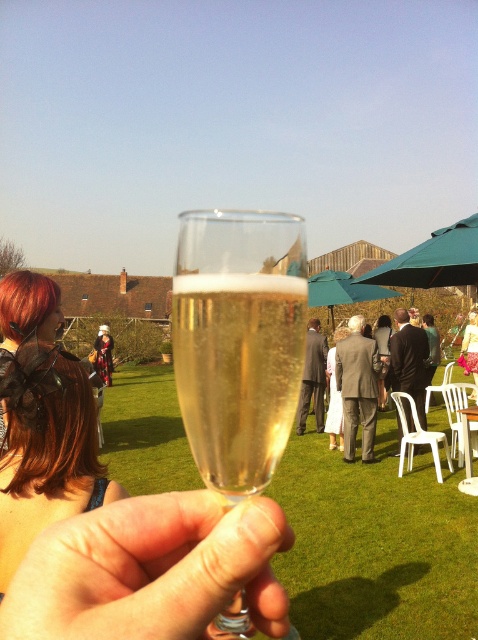
Between green grass at center and teal fabric umbrella at upper right, which one appears on the right side from the viewer's perspective?

teal fabric umbrella at upper right is more to the right.

Which is behind, point (282, 579) or point (379, 280)?

Positioned behind is point (379, 280).

You are a GUI agent. You are given a task and a screenshot of the screen. Output one action in this format:
    pyautogui.click(x=<x>, y=<y>)
    Task: Click on the green grass at center
    
    Given the screenshot: What is the action you would take?
    pyautogui.click(x=375, y=544)

Who is more distant from viewer, (151, 417) or (237, 282)?

Positioned behind is point (151, 417).

Can you confirm if green grass at center is bigger than translucent glass flute at center?

Yes.

Is point (325, 544) closer to camera compared to point (256, 314)?

No.

In order to click on green grass at center in this screenshot , I will do `click(375, 544)`.

Is point (62, 536) behind point (198, 326)?

That is False.

Does translucent glass at center have a greater width compared to translucent glass flute at center?

Indeed, translucent glass at center has a greater width compared to translucent glass flute at center.

Locate an element on the screen. translucent glass at center is located at coordinates (150, 570).